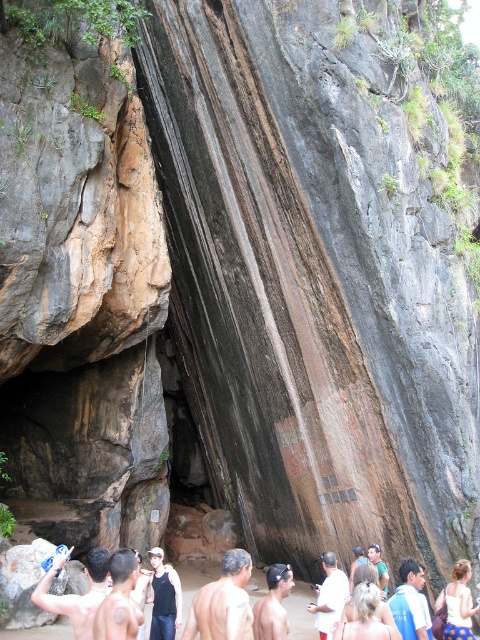
Question: Which point is farther to the camera?

Choices:
 (A) shiny metallic towel at lower left
 (B) gray hair at lower center
 (C) green fabric shirt at center

Answer: (C)

Question: Is shiny metallic arm at lower center below smooth skin man at center?

Choices:
 (A) yes
 (B) no

Answer: (B)

Question: Among these objects, which one is nearest to the camera?

Choices:
 (A) white matte shirt at center
 (B) smooth brown skin at center
 (C) smooth skin man at center

Answer: (C)

Question: Among these objects, which one is farthest from the camera?

Choices:
 (A) smooth brown skin at center
 (B) shiny metallic arm at lower center
 (C) black cotton shirt at center
 (D) smooth skin man at center

Answer: (C)

Question: Can you confirm if smooth brown skin at center is positioned to the left of smooth skin man at center?

Choices:
 (A) no
 (B) yes

Answer: (A)

Question: Considering the relative positions of white matte shirt at center and green fabric shirt at center in the image provided, where is white matte shirt at center located with respect to green fabric shirt at center?

Choices:
 (A) left
 (B) right

Answer: (A)